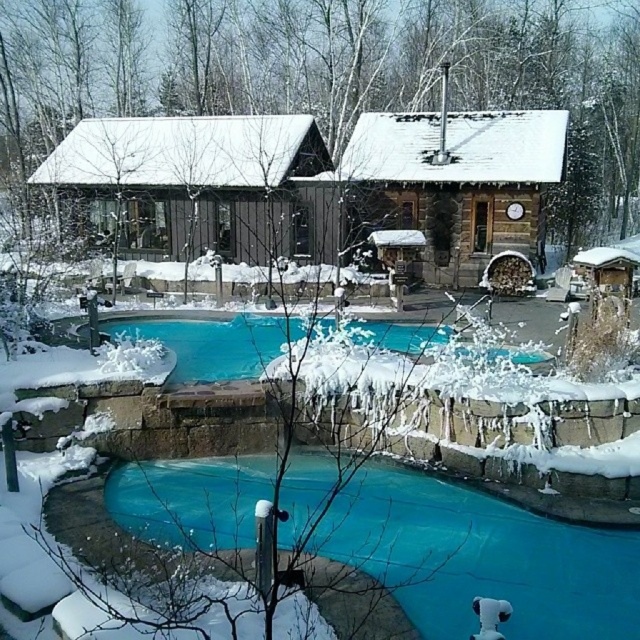
How distant is blue tarp at lower center from blue glassy swimming pool at center?

26.50 feet

Is point (179, 516) farther from viewer compared to point (445, 330)?

No.

Where is `blue tarp at lower center`? The image size is (640, 640). blue tarp at lower center is located at coordinates tap(481, 557).

Which is in front, point (285, 116) or point (68, 321)?

Point (68, 321)

Does point (141, 170) come behind point (244, 355)?

Yes, it is behind point (244, 355).

Where is `brown wooden cabin at center`? The width and height of the screenshot is (640, 640). brown wooden cabin at center is located at coordinates (200, 182).

Who is positioned more to the left, brown wooden cabin at center or wooden cabin at center?

Positioned to the left is brown wooden cabin at center.

Is brown wooden cabin at center in front of wooden cabin at center?

No, brown wooden cabin at center is behind wooden cabin at center.

Locate an element on the screen. brown wooden cabin at center is located at coordinates (200, 182).